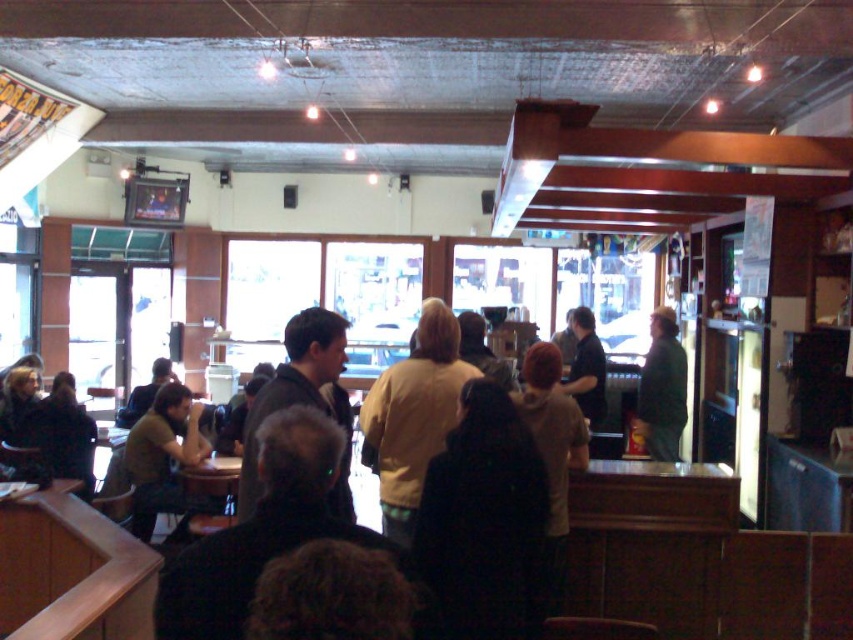
Question: Which point appears farthest from the camera in this image?

Choices:
 (A) (683, 390)
 (B) (257, 484)
 (C) (143, 531)
 (D) (404, 502)

Answer: (A)

Question: Does dark gray sweater at center come in front of matte green shirt at left?

Choices:
 (A) yes
 (B) no

Answer: (A)

Question: Among these points, which one is nearest to the camera?

Choices:
 (A) (247, 458)
 (B) (424, 365)
 (C) (683, 378)
 (D) (183, 445)

Answer: (A)

Question: Considering the relative positions of light yellow jacket at center and green matte jacket at center in the image provided, where is light yellow jacket at center located with respect to green matte jacket at center?

Choices:
 (A) above
 (B) below

Answer: (A)

Question: Does matte green shirt at left have a smaller size compared to green matte jacket at center?

Choices:
 (A) yes
 (B) no

Answer: (B)

Question: Which point appears farthest from the camera in this image?

Choices:
 (A) (126, 449)
 (B) (425, 301)

Answer: (B)